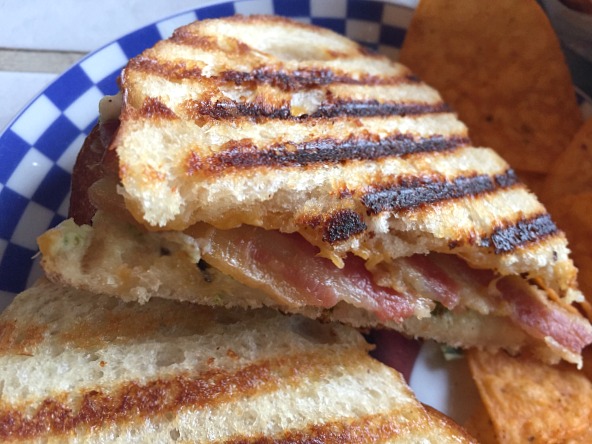
The height and width of the screenshot is (444, 592). What are the coordinates of `edge of plate` in the screenshot? It's located at (57, 171), (99, 76), (349, 13).